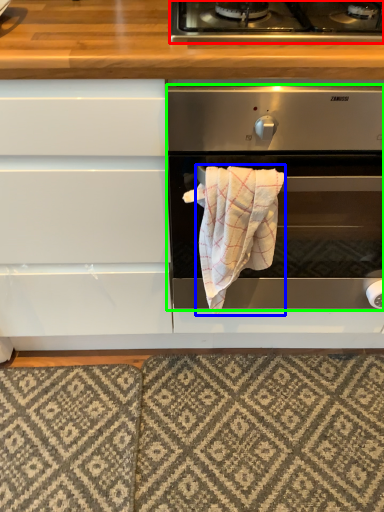
Question: Based on their relative distances, which object is nearer to gas stove (highlighted by a red box)? Choose from bath towel (highlighted by a blue box) and oven (highlighted by a green box).

Choices:
 (A) bath towel
 (B) oven

Answer: (B)